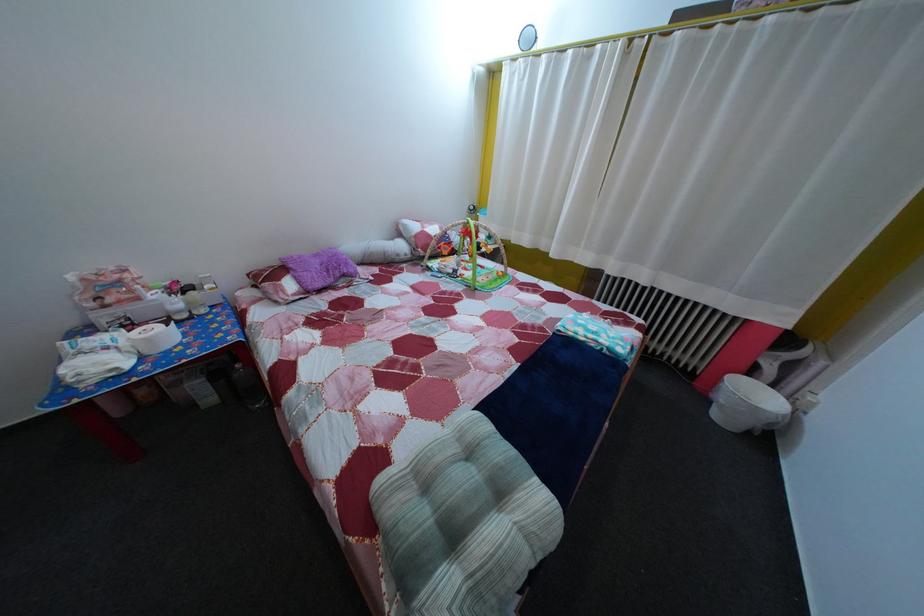
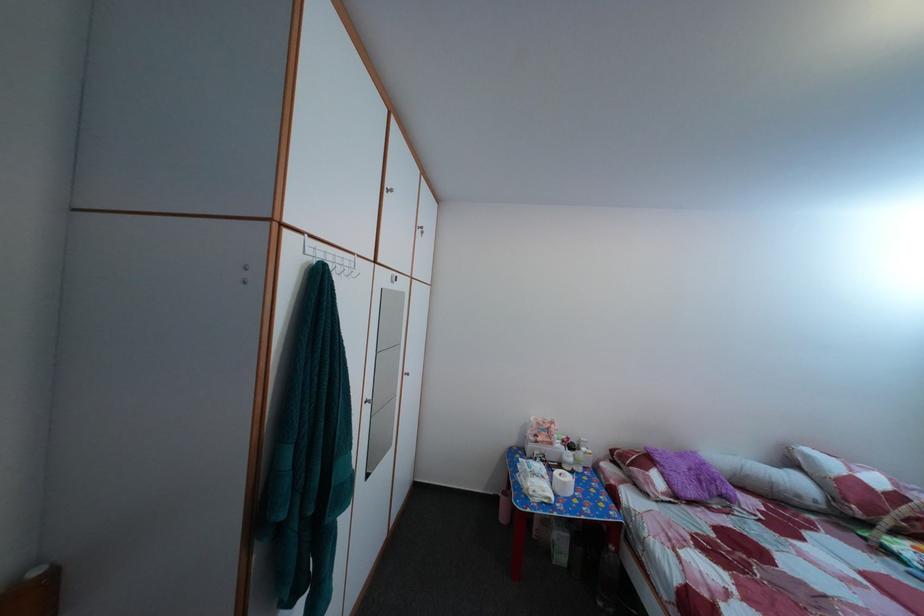
Where in the second image is the point corresponding to (325,262) from the first image?

(689, 464)